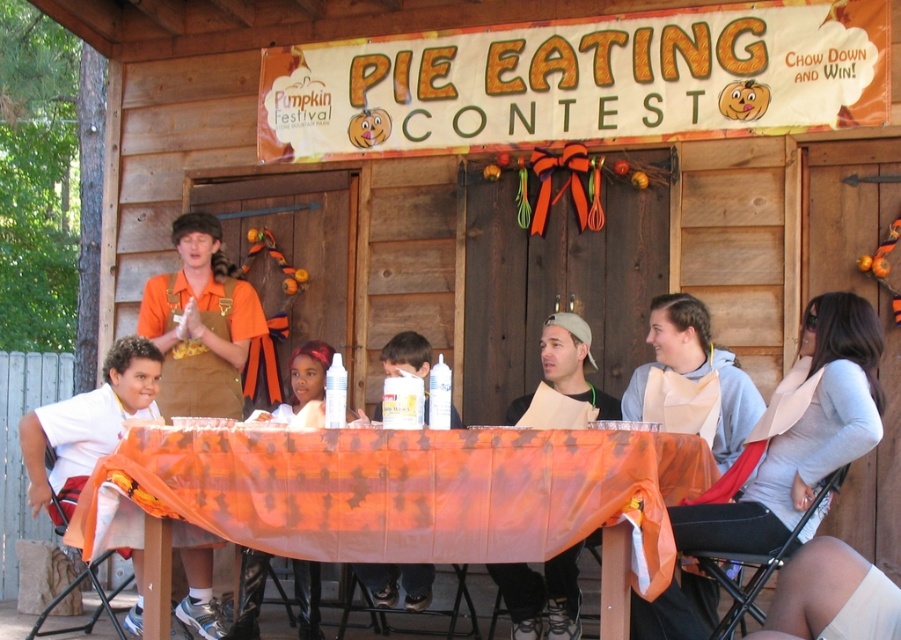
You are a contestant in the pumpkin pie eating contest and you need to choose a bib. The light beige paper bib at lower right and the white paper bib at center are available. Which bib is bigger?

The light beige paper bib at lower right is larger in size than the white paper bib at center, so the light beige paper bib at lower right is bigger.

Consider the image. You are a photographer at the pumpkin festival and want to capture a closeup of the orange sheer fabric at center and the light beige paper bib at lower right in the same frame. The camera you are using has a maximum focus range of 60 centimeters. Will you be able to fit both items in the frame without moving the camera?

The orange sheer fabric at center and light beige paper bib at lower right are 67.61 centimeters apart. Since the distance between them exceeds the camera maximum focus range of 60 centimeters, you will not be able to fit both items in the frame without moving the camera.